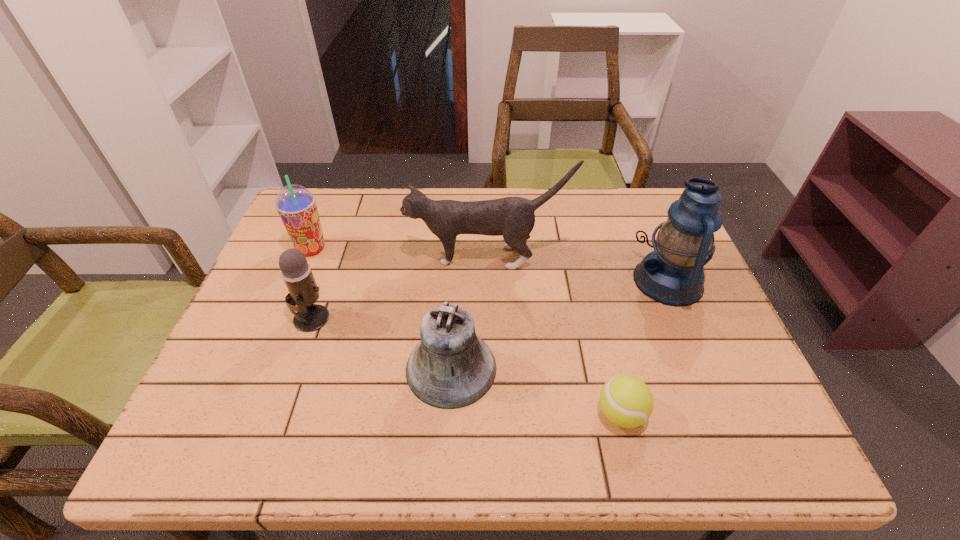
Where is `free space at the far edge of the desktop`? This screenshot has height=540, width=960. free space at the far edge of the desktop is located at coordinates (352, 223).

Where is `free space at the near edge`? The width and height of the screenshot is (960, 540). free space at the near edge is located at coordinates (690, 446).

Where is `vacant space at the left edge`? vacant space at the left edge is located at coordinates (327, 245).

Where is `vacant space at the right edge of the desktop`? The image size is (960, 540). vacant space at the right edge of the desktop is located at coordinates (726, 355).

Find the location of `vacant area between the tennis ball and the bell`. vacant area between the tennis ball and the bell is located at coordinates (536, 391).

This screenshot has width=960, height=540. In order to click on empty space that is in between the shortest object and the bell in this screenshot , I will do `click(536, 391)`.

This screenshot has width=960, height=540. Find the location of `empty space between the tennis ball and the lantern`. empty space between the tennis ball and the lantern is located at coordinates (644, 347).

This screenshot has width=960, height=540. I want to click on vacant area that lies between the microphone and the lantern, so click(490, 300).

Identify the location of vacant area that lies between the smoothie and the rightmost object. (490, 265).

I want to click on free spot between the tennis ball and the rightmost object, so click(x=644, y=347).